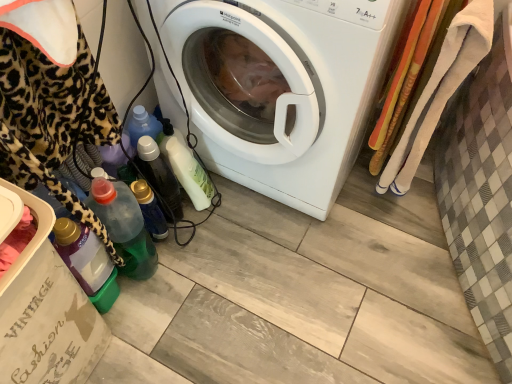
What are the coordinates of `free location in front of white glossy washing machine at center` in the screenshot? It's located at (291, 288).